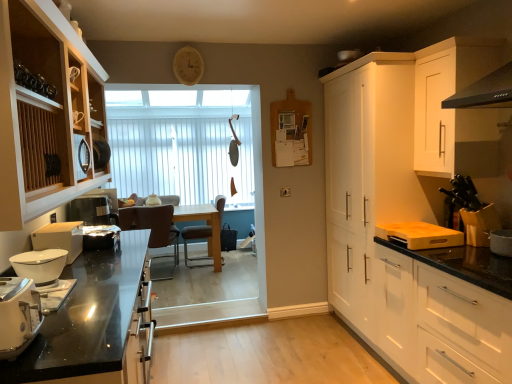
Question: Are white glossy bowl at left, which is the 3th kitchen appliance in front-to-back order, and white plastic toaster at lower left, positioned as the 1th kitchen appliance in front-to-back order, beside each other?

Choices:
 (A) yes
 (B) no

Answer: (B)

Question: From a real-world perspective, is white glossy bowl at left, positioned as the 1th kitchen appliance in back-to-front order, beneath white plastic toaster at lower left, the 3th kitchen appliance in the back-to-front sequence?

Choices:
 (A) no
 (B) yes

Answer: (A)

Question: From the image's perspective, is white glossy bowl at left, positioned as the 1th kitchen appliance in back-to-front order, under white plastic toaster at lower left, the 3th kitchen appliance in the back-to-front sequence?

Choices:
 (A) yes
 (B) no

Answer: (B)

Question: Can you confirm if white glossy bowl at left, which is the 3th kitchen appliance in front-to-back order, is taller than white plastic toaster at lower left, positioned as the 1th kitchen appliance in front-to-back order?

Choices:
 (A) yes
 (B) no

Answer: (A)

Question: Is white plastic toaster at lower left, the 3th kitchen appliance in the back-to-front sequence, inside white glossy bowl at left, positioned as the 1th kitchen appliance in back-to-front order?

Choices:
 (A) yes
 (B) no

Answer: (B)

Question: Is white glossy bowl at left, which is the 3th kitchen appliance in front-to-back order, not within white plastic toaster at lower left, the 3th kitchen appliance in the back-to-front sequence?

Choices:
 (A) no
 (B) yes

Answer: (B)

Question: Is black glass countertop at lower left to the left of white glossy bowl at left, arranged as the second kitchen appliance when viewed from the back, from the viewer's perspective?

Choices:
 (A) yes
 (B) no

Answer: (B)

Question: Could white glossy bowl at left, arranged as the second kitchen appliance when viewed from the back, be considered to be inside black glass countertop at lower left?

Choices:
 (A) no
 (B) yes

Answer: (A)

Question: From a real-world perspective, is black glass countertop at lower left beneath white glossy bowl at left, acting as the second kitchen appliance starting from the front?

Choices:
 (A) no
 (B) yes

Answer: (B)

Question: Does black glass countertop at lower left have a smaller size compared to white glossy bowl at left, arranged as the second kitchen appliance when viewed from the back?

Choices:
 (A) yes
 (B) no

Answer: (B)

Question: From the image's perspective, is black glass countertop at lower left below white glossy bowl at left, arranged as the second kitchen appliance when viewed from the back?

Choices:
 (A) no
 (B) yes

Answer: (B)

Question: Does black glass countertop at lower left have a greater width compared to white glossy bowl at left, arranged as the second kitchen appliance when viewed from the back?

Choices:
 (A) yes
 (B) no

Answer: (A)

Question: Can you confirm if brown leather chair at center is bigger than black glass countertop at lower left?

Choices:
 (A) no
 (B) yes

Answer: (A)